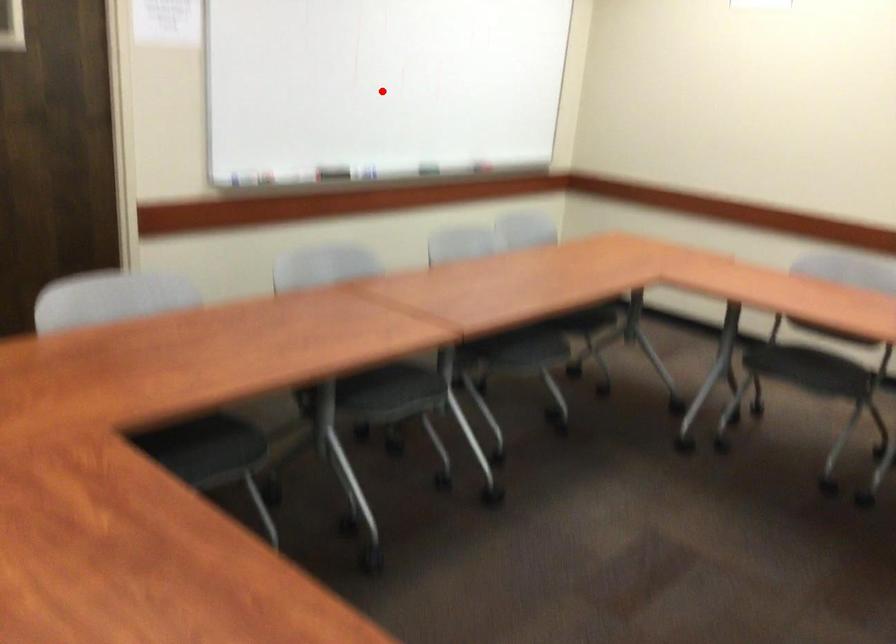
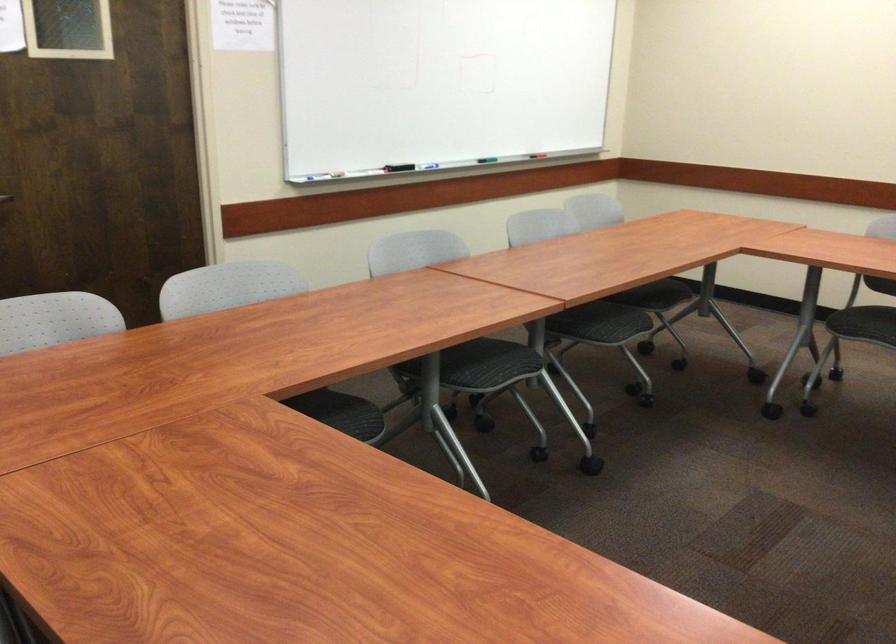
Where in the second image is the point corresponding to the highlighted location from the first image?

(438, 82)